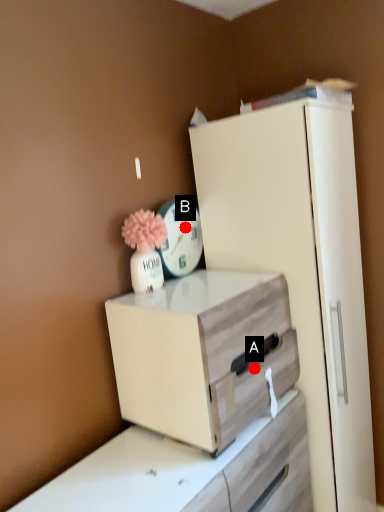
Question: Two points are circled on the image, labeled by A and B beside each circle. Which of the following is the farthest from the observer?

Choices:
 (A) A is further
 (B) B is further

Answer: (B)